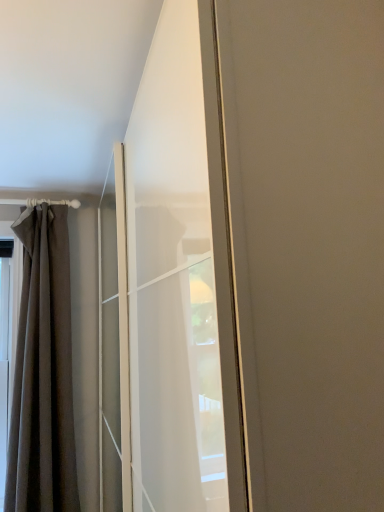
Measure the distance between point (66, 341) and camera.

The distance of point (66, 341) from camera is 7.76 feet.

Where is `dark gray textured curtain at left`? The height and width of the screenshot is (512, 384). dark gray textured curtain at left is located at coordinates (43, 372).

This screenshot has width=384, height=512. What do you see at coordinates (43, 372) in the screenshot?
I see `dark gray textured curtain at left` at bounding box center [43, 372].

You are a GUI agent. You are given a task and a screenshot of the screen. Output one action in this format:
    pyautogui.click(x=<x>, y=<y>)
    Task: Click on the dark gray textured curtain at left
    
    Given the screenshot: What is the action you would take?
    pyautogui.click(x=43, y=372)